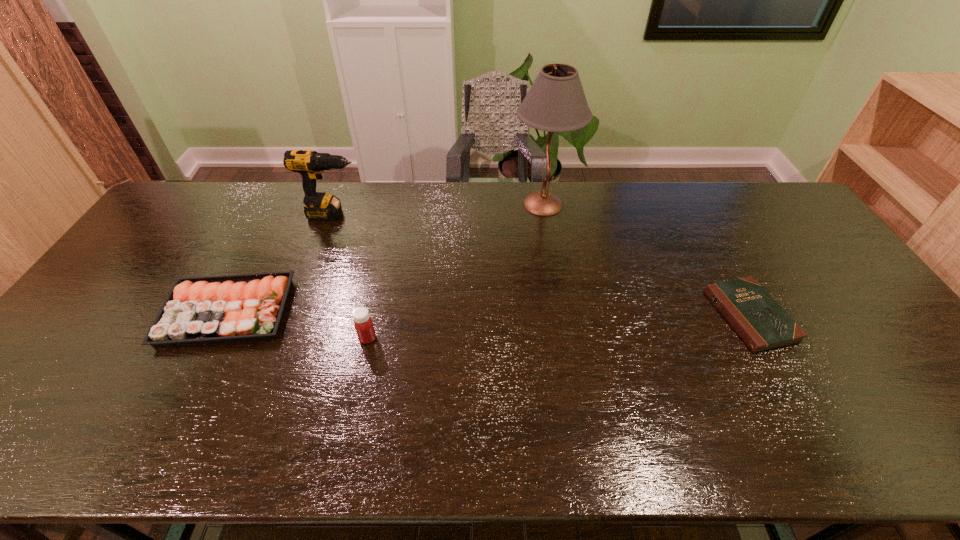
You are a GUI agent. You are given a task and a screenshot of the screen. Output one action in this format:
    pyautogui.click(x=<x>, y=<y>)
    Task: Click on the free space that satisfies the following two spatial constraints: 1. on the front-facing side of the tallest object; 2. on the right side of the Bible
    Image resolution: width=960 pixels, height=540 pixels.
    Given the screenshot: What is the action you would take?
    pyautogui.click(x=562, y=316)

Identify the location of free space in the image that satisfies the following two spatial constraints: 1. at the tip of the fourth shortest object; 2. on the front side of the second shortest object. (298, 312).

At what (x,y) coordinates should I click in order to perform the action: click on free location that satisfies the following two spatial constraints: 1. at the tip of the second tallest object; 2. on the back side of the third tallest object. Please return your answer as a coordinate pair (x, y). This screenshot has height=540, width=960. Looking at the image, I should click on click(288, 338).

This screenshot has height=540, width=960. Identify the location of vacant area in the image that satisfies the following two spatial constraints: 1. on the front-facing side of the table lamp; 2. on the front side of the second shortest object. (561, 312).